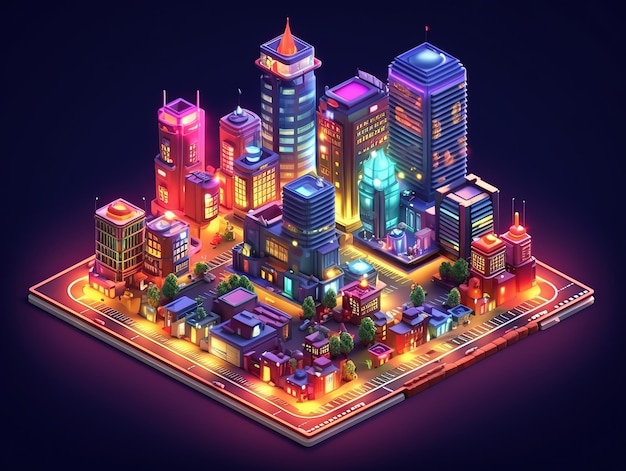
Identify the location of windows. (213, 198), (211, 209).